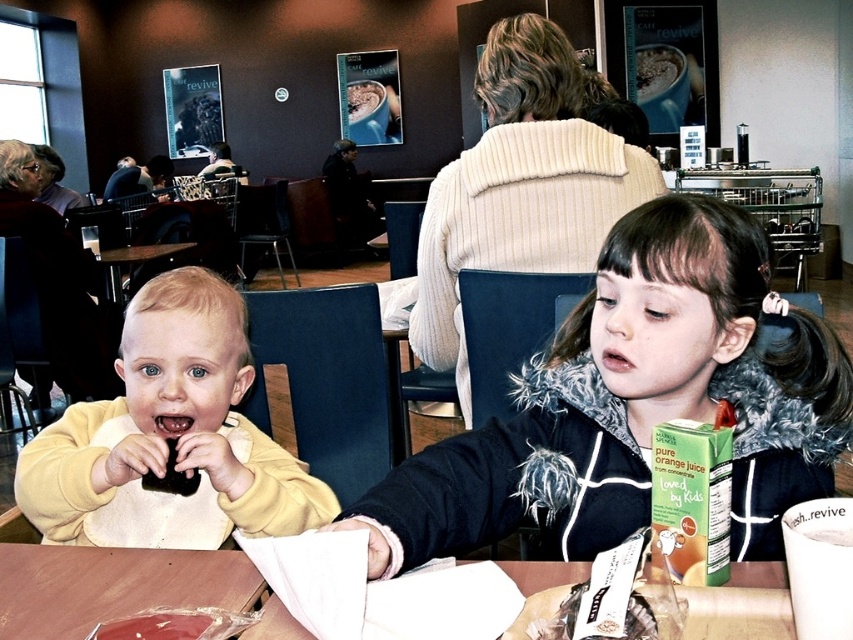
Can you confirm if yellow fleece bib at center is positioned below wooden table at lower left?

Incorrect, yellow fleece bib at center is not positioned below wooden table at lower left.

Does yellow fleece bib at center have a greater height compared to wooden table at lower left?

Yes, yellow fleece bib at center is taller than wooden table at lower left.

What do you see at coordinates (169, 436) in the screenshot? I see `yellow fleece bib at center` at bounding box center [169, 436].

Find the location of a particular element. yellow fleece bib at center is located at coordinates (169, 436).

Is point (107, 621) closer to camera compared to point (354, 116)?

Yes, point (107, 621) is in front of point (354, 116).

Is shiny plastic bag at table front shorter than smooth chocolate cake at center?

Indeed, shiny plastic bag at table front has a lesser height compared to smooth chocolate cake at center.

Does point (164, 632) lie in front of point (363, 92)?

Yes, point (164, 632) is in front of point (363, 92).

At what (x,y) coordinates should I click in order to perform the action: click on shiny plastic bag at table front. Please return your answer as a coordinate pair (x, y). This screenshot has width=853, height=640. Looking at the image, I should click on (164, 625).

Can you confirm if white paper bag at lower center is shorter than smooth chocolate cake at center?

Indeed, white paper bag at lower center has a lesser height compared to smooth chocolate cake at center.

What are the coordinates of `white paper bag at lower center` in the screenshot? It's located at (560, 618).